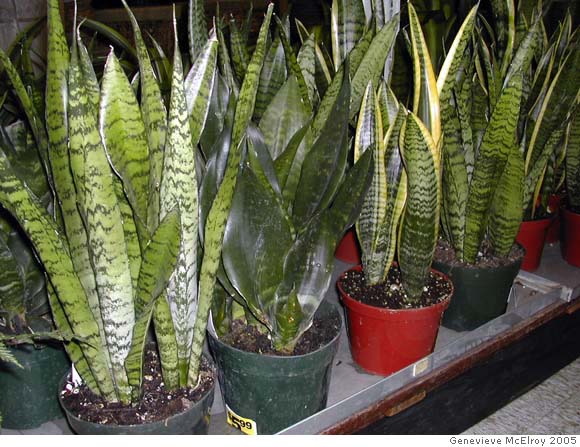
The image size is (580, 447). I want to click on red orange planters, so click(x=387, y=327), click(x=351, y=241), click(x=525, y=229), click(x=572, y=229).